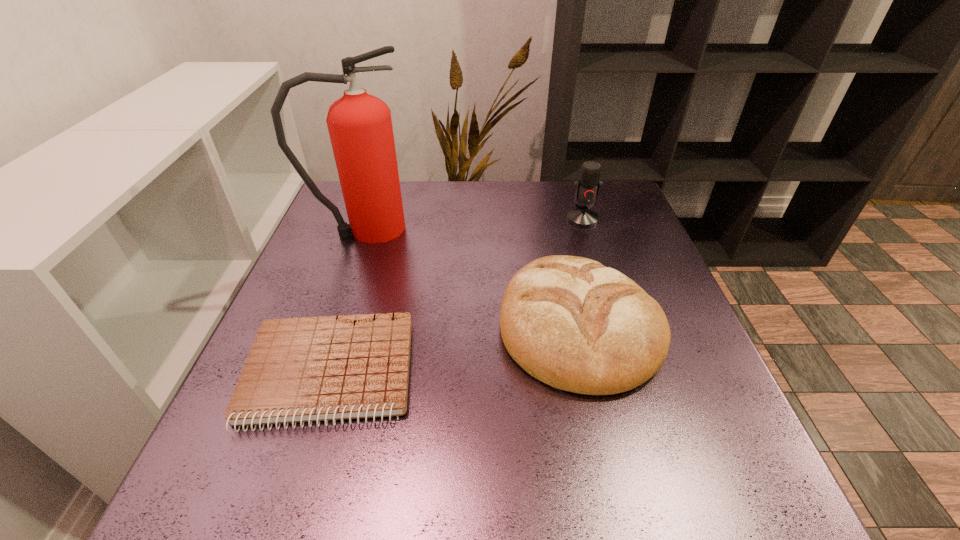
In the image, there is a desktop. Identify the location of free region at the near left corner. The width and height of the screenshot is (960, 540). pos(253,492).

In the image, there is a desktop. Identify the location of free space at the near right corner. Image resolution: width=960 pixels, height=540 pixels. (733, 481).

You are a GUI agent. You are given a task and a screenshot of the screen. Output one action in this format:
    pyautogui.click(x=<x>, y=<y>)
    Task: Click on the free space between the third shortest object and the shortest object
    The image size is (960, 540).
    Given the screenshot: What is the action you would take?
    pyautogui.click(x=456, y=296)

In order to click on free area in between the fire extinguisher and the second tallest object in this screenshot , I will do `click(473, 224)`.

Find the location of `free space between the tallest object and the bread`. free space between the tallest object and the bread is located at coordinates (472, 277).

The width and height of the screenshot is (960, 540). What are the coordinates of `blank region between the microphone and the shortest object` in the screenshot? It's located at (456, 296).

The image size is (960, 540). What are the coordinates of `free spot between the notebook and the third tallest object` in the screenshot? It's located at click(455, 349).

Where is `free space between the tallest object and the second shortest object`? The width and height of the screenshot is (960, 540). free space between the tallest object and the second shortest object is located at coordinates (472, 277).

The width and height of the screenshot is (960, 540). I want to click on vacant area that lies between the bread and the fire extinguisher, so click(x=472, y=277).

Locate which object is the second closest to the fire extinguisher. Please provide its 2D coordinates. Your answer should be formatted as a tuple, i.e. [(x, y)], where the tuple contains the x and y coordinates of a point satisfying the conditions above.

[(306, 369)]